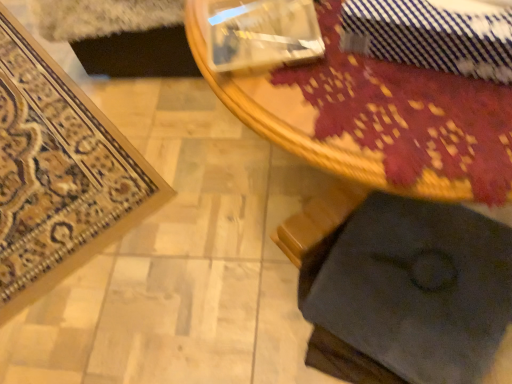
At what (x,y) coordinates should I click in order to perform the action: click on wooden table at center. Please return your answer as a coordinate pair (x, y). Looking at the image, I should click on (373, 117).

Where is `blue striped tie at upper right`? The height and width of the screenshot is (384, 512). blue striped tie at upper right is located at coordinates (433, 35).

Where is `wooden table at center`? The width and height of the screenshot is (512, 384). wooden table at center is located at coordinates (373, 117).

Which of these two, dark fabric cushion at lower right or carpeted mat at lower left, is thinner?

Thinner between the two is dark fabric cushion at lower right.

Can you see dark fabric cushion at lower right touching carpeted mat at lower left?

They are not placed beside each other.

Who is more distant, dark fabric cushion at lower right or carpeted mat at lower left?

carpeted mat at lower left.

Would you say blue striped tie at upper right is a long distance from wooden table at center?

blue striped tie at upper right is actually quite close to wooden table at center.

Consider the image. Can you confirm if blue striped tie at upper right is thinner than wooden table at center?

Yes.

Does blue striped tie at upper right have a larger size compared to wooden table at center?

No.

Is the position of blue striped tie at upper right more distant than that of carpeted mat at lower left?

No, it is in front of carpeted mat at lower left.

Visually, is blue striped tie at upper right positioned to the left or to the right of carpeted mat at lower left?

From the image, it's evident that blue striped tie at upper right is to the right of carpeted mat at lower left.

I want to click on mat that is behind the blue striped tie at upper right, so click(x=59, y=173).

Can you confirm if blue striped tie at upper right is smaller than carpeted mat at lower left?

Indeed, blue striped tie at upper right has a smaller size compared to carpeted mat at lower left.

Does carpeted mat at lower left have a larger size compared to blue striped tie at upper right?

Correct, carpeted mat at lower left is larger in size than blue striped tie at upper right.

Considering the positions of objects carpeted mat at lower left and blue striped tie at upper right in the image provided, who is more to the right, carpeted mat at lower left or blue striped tie at upper right?

blue striped tie at upper right.

Is carpeted mat at lower left surrounding blue striped tie at upper right?

No, blue striped tie at upper right is not inside carpeted mat at lower left.

Is blue striped tie at upper right placed right next to dark fabric cushion at lower right?

No, blue striped tie at upper right is not touching dark fabric cushion at lower right.

Does point (403, 32) lie behind point (326, 259)?

No, (403, 32) is closer to viewer.

From a real-world perspective, is blue striped tie at upper right under dark fabric cushion at lower right?

No, from a real-world perspective, blue striped tie at upper right is not below dark fabric cushion at lower right.

Between wooden table at center and blue striped tie at upper right, which one has more height?

wooden table at center.

Is wooden table at center outside of blue striped tie at upper right?

That's correct, wooden table at center is outside of blue striped tie at upper right.

Consider the image. Measure the distance between wooden table at center and blue striped tie at upper right.

wooden table at center and blue striped tie at upper right are 3.49 inches apart from each other.

Is wooden table at center positioned with its back to blue striped tie at upper right?

No, wooden table at center's orientation is not away from blue striped tie at upper right.

Looking at this image, could you tell me if dark fabric cushion at lower right is turned towards blue striped tie at upper right?

No, dark fabric cushion at lower right is not oriented towards blue striped tie at upper right.

Is dark fabric cushion at lower right next to blue striped tie at upper right and touching it?

No.

From the image's perspective, does dark fabric cushion at lower right appear lower than blue striped tie at upper right?

Correct, dark fabric cushion at lower right appears lower than blue striped tie at upper right in the image.

Between point (312, 211) and point (461, 27), which one is positioned in front?

The point (461, 27) is more forward.

Where is `swivel chair in front of the carpeted mat at lower left`? swivel chair in front of the carpeted mat at lower left is located at coordinates (400, 287).

You are a GUI agent. You are given a task and a screenshot of the screen. Output one action in this format:
    pyautogui.click(x=<x>, y=<y>)
    Task: Click on the table below the blue striped tie at upper right (from the image's perspective)
    
    Given the screenshot: What is the action you would take?
    pyautogui.click(x=373, y=117)

From the image, which object appears to be nearer to blue striped tie at upper right, wooden table at center or carpeted mat at lower left?

wooden table at center.

When comparing their distances from wooden table at center, does blue striped tie at upper right or dark fabric cushion at lower right seem closer?

Answer: blue striped tie at upper right is positioned closer to the anchor wooden table at center.

From the image, which object appears to be nearer to blue striped tie at upper right, wooden table at center or dark fabric cushion at lower right?

wooden table at center is closer to blue striped tie at upper right.

Estimate the real-world distances between objects in this image. Which object is closer to wooden table at center, carpeted mat at lower left or dark fabric cushion at lower right?

The object closer to wooden table at center is dark fabric cushion at lower right.

When comparing their distances from blue striped tie at upper right, does carpeted mat at lower left or dark fabric cushion at lower right seem closer?

dark fabric cushion at lower right lies closer to blue striped tie at upper right than the other object.

Looking at the image, which one is located further to carpeted mat at lower left, blue striped tie at upper right or wooden table at center?

The object further to carpeted mat at lower left is blue striped tie at upper right.

Consider the image. Which object lies nearer to the anchor point blue striped tie at upper right, dark fabric cushion at lower right or carpeted mat at lower left?

Based on the image, dark fabric cushion at lower right appears to be nearer to blue striped tie at upper right.

Which object lies nearer to the anchor point carpeted mat at lower left, dark fabric cushion at lower right or blue striped tie at upper right?

dark fabric cushion at lower right lies closer to carpeted mat at lower left than the other object.

Find the location of a particular element. Image resolution: width=512 pixels, height=384 pixels. tie situated between carpeted mat at lower left and wooden table at center from left to right is located at coordinates (433, 35).

The image size is (512, 384). I want to click on table between carpeted mat at lower left and dark fabric cushion at lower right, so click(373, 117).

Find the location of a particular element. tie between carpeted mat at lower left and dark fabric cushion at lower right in the horizontal direction is located at coordinates (433, 35).

This screenshot has width=512, height=384. In order to click on table between blue striped tie at upper right and dark fabric cushion at lower right in the up-down direction in this screenshot , I will do `click(373, 117)`.